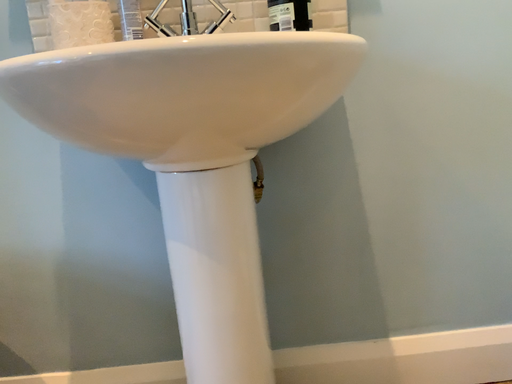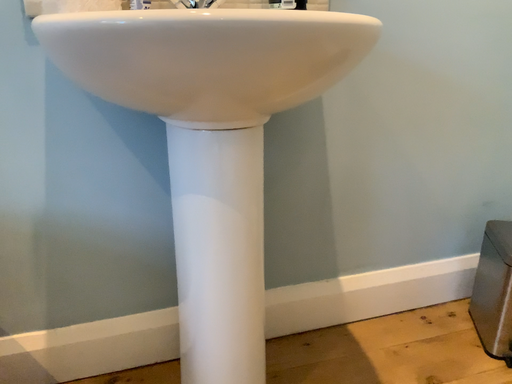
Question: Which way did the camera rotate in the video?

Choices:
 (A) rotated right
 (B) rotated left

Answer: (A)